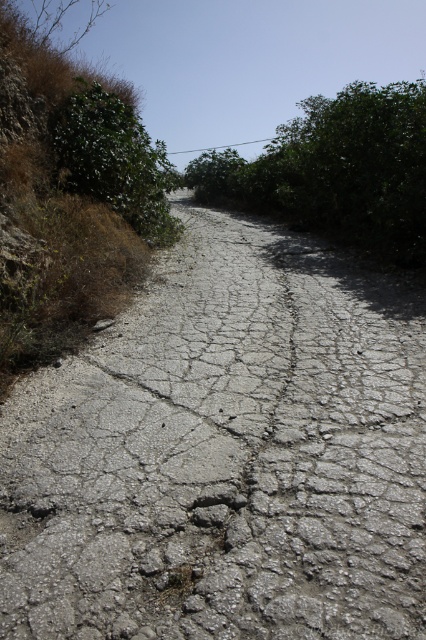
You are a delivery robot with a width of 1.2 meters. You need to navigate through the cracked concrete road at center to deliver a package. The green leafy bush at upper left is blocking part of the road. Can you pass through the remaining clear space on the road?

The cracked concrete road at center is wider than the green leafy bush at upper left. Subtracting the width of the bush from the road, the remaining clear space is still larger than the robot width of 1.2 meters. Therefore, the robot can pass through the remaining clear space on the cracked concrete road at center.

You are a hiker who wants to take a photo of the green leafy bush at center and the green leafy bush at upper left. Which one should you stand closer to in order to capture both bushes in the frame without moving the camera?

You should stand closer to the green leafy bush at upper left because it is shorter than the green leafy bush at center, allowing both to be in the frame when positioned appropriately.